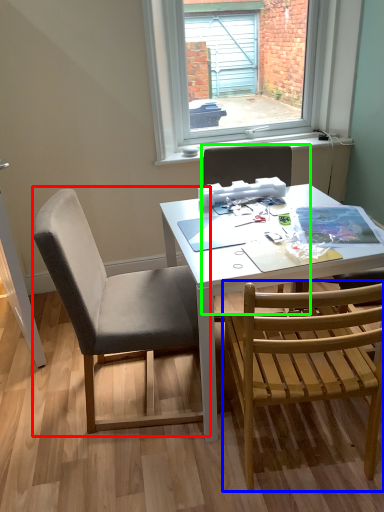
Question: Estimate the real-world distances between objects in this image. Which object is closer to chair (highlighted by a red box), chair (highlighted by a blue box) or chair (highlighted by a green box)?

Choices:
 (A) chair
 (B) chair

Answer: (A)